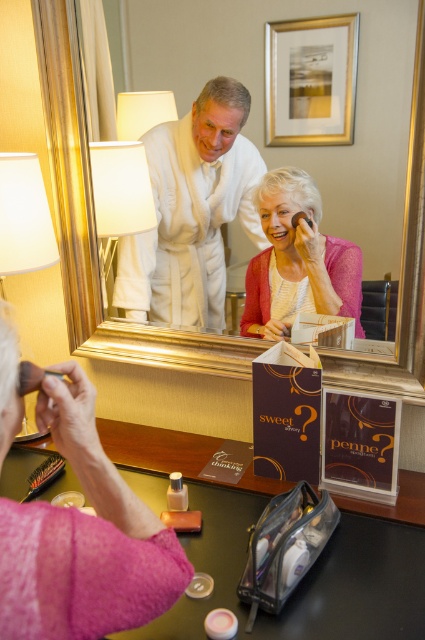
You are a hotel housekeeper inspecting the room. You notice the white fabric lampshade at upper left and the matte black brush at lower left. Which object is bigger in size?

The white fabric lampshade at upper left is larger in size compared to the matte black brush at lower left.

You are a hotel housekeeper checking the room. You need to retrieve the matte black brush at lower left. Is the white fabric lampshade at upper left blocking your access to it?

The white fabric lampshade at upper left is positioned over the matte black brush at lower left, so it is blocking access to the brush.